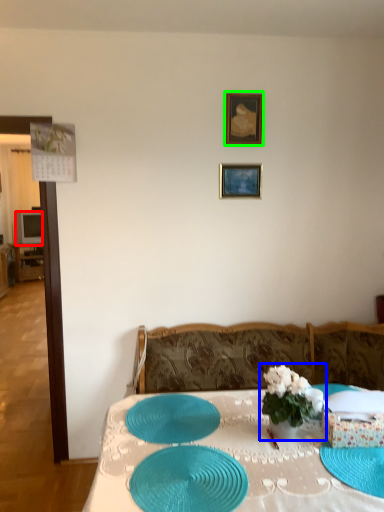
Question: Which object is the farthest from television (highlighted by a red box)? Choose among these: houseplant (highlighted by a blue box) or picture frame (highlighted by a green box).

Choices:
 (A) houseplant
 (B) picture frame

Answer: (A)